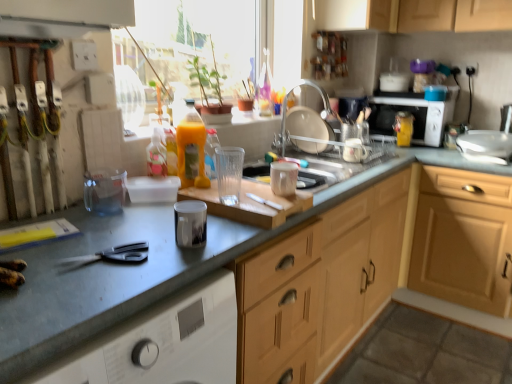
Identify the location of vacant space situated above wooden cutting board at center (from a real-world perspective). (244, 185).